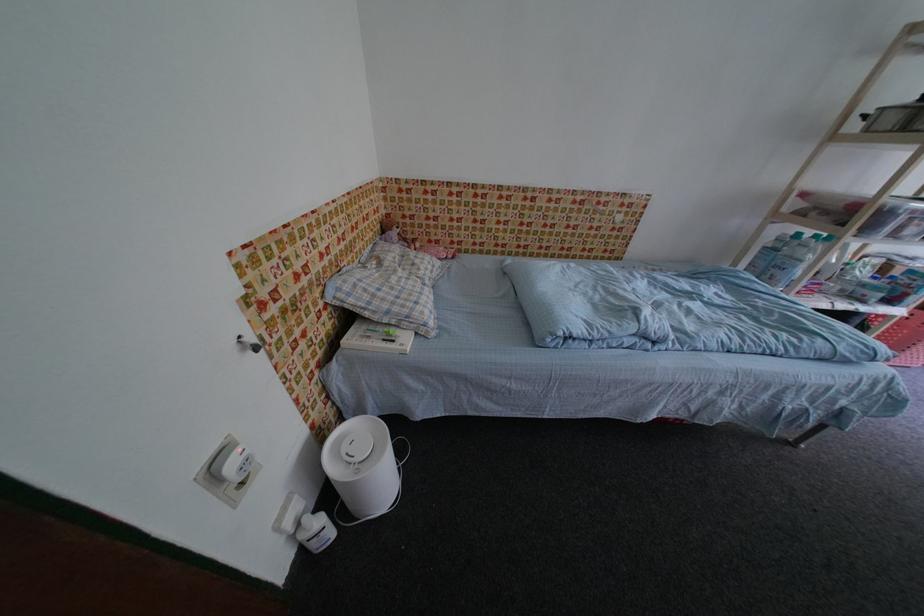
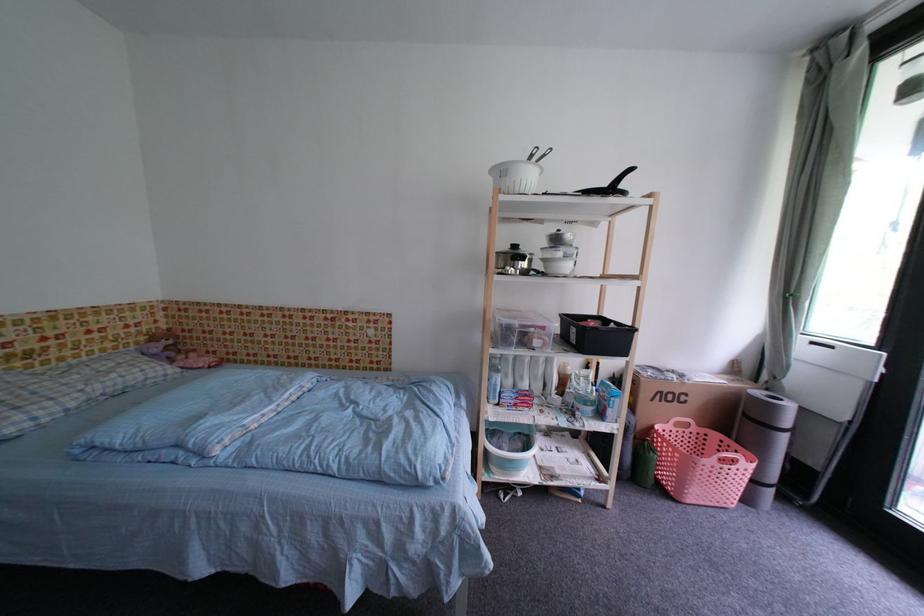
Question: What movement of the cameraman would produce the second image?

Choices:
 (A) Left
 (B) Right
 (C) Forward
 (D) Backward

Answer: (B)